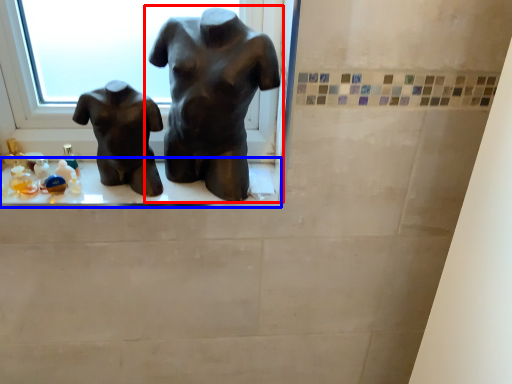
Question: Which object appears farthest to the camera in this image, statue (sculpture) (highlighted by a red box) or window sill (highlighted by a blue box)?

Choices:
 (A) statue (sculpture)
 (B) window sill

Answer: (B)